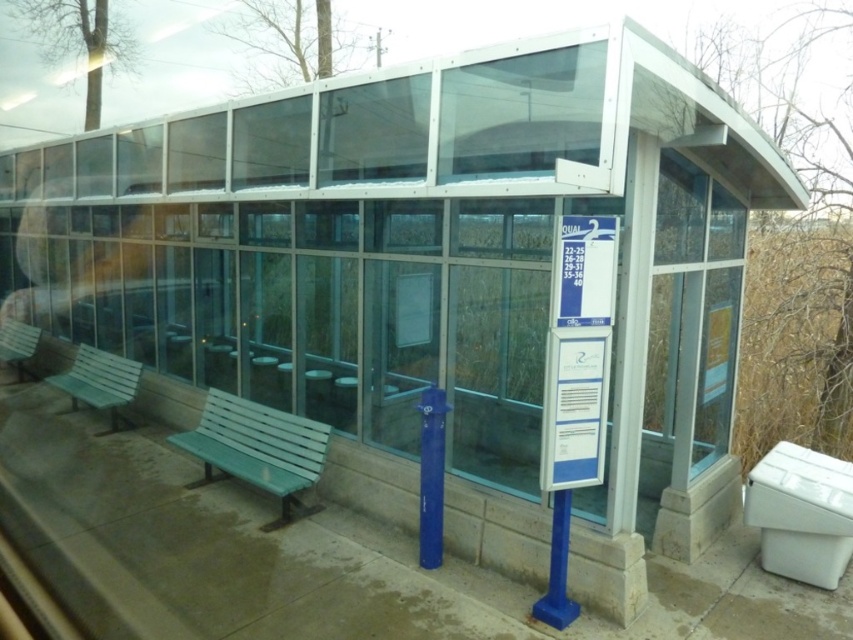
You are a maintenance worker inspecting the bus shelter. You need to determine if the clear glass window at center can be replaced with a new one that is the same size as the white plastic toilet bowl at lower right. Based on the current dimensions, will the new window fit properly?

The clear glass window at center has a larger size compared to the white plastic toilet bowl at lower right. Therefore, replacing it with a window the same size as the white plastic toilet bowl at lower right would result in a smaller window, which may not fit properly or cover the entire opening.

You are standing at the bus shelter and want to check if the point at coordinates (x=810, y=566) is within a safe distance for a service worker to reach without moving too far. The service worker can comfortably reach up to 15 feet. Is the point within reach?

The point at coordinates (x=810, y=566) is 15.63 feet away from the viewer, which exceeds the service worker comfortable reach of 15 feet. Therefore, the point is slightly out of reach.